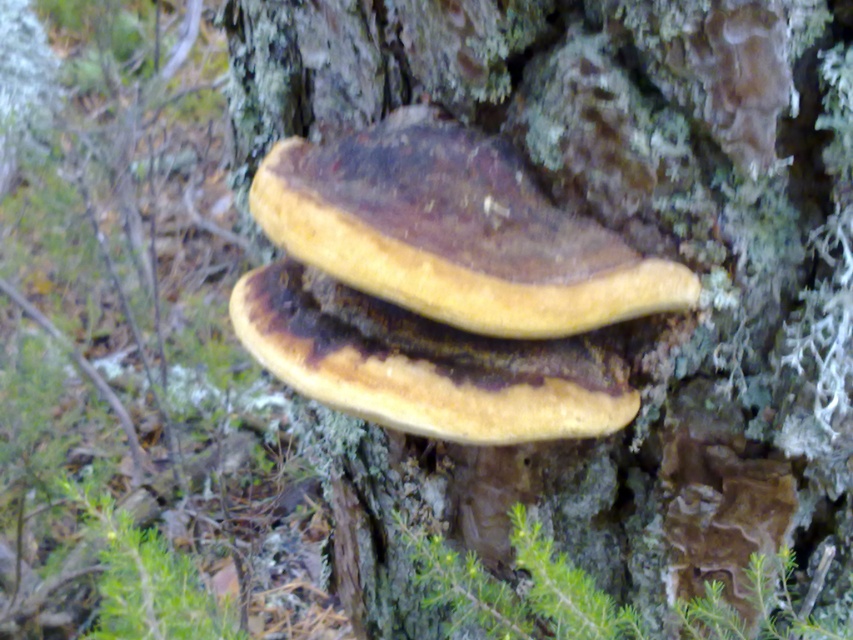
From the picture: Is brown leathery fungus at center positioned behind yellowish-brown wood at center?

No, it is not.

Does point (390, 125) come closer to viewer compared to point (331, 364)?

No, (390, 125) is further to viewer.

Where is `brown leathery fungus at center`? This screenshot has width=853, height=640. brown leathery fungus at center is located at coordinates (454, 230).

From the picture: Can you confirm if brown/corky mushroom at center is wider than yellowish-brown wood at center?

Indeed, brown/corky mushroom at center has a greater width compared to yellowish-brown wood at center.

Can you confirm if brown/corky mushroom at center is positioned to the left of yellowish-brown wood at center?

Incorrect, brown/corky mushroom at center is not on the left side of yellowish-brown wood at center.

Which is in front, point (656, 77) or point (543, 362)?

Positioned in front is point (656, 77).

Find the location of a particular element. The width and height of the screenshot is (853, 640). brown/corky mushroom at center is located at coordinates (633, 244).

Who is positioned more to the right, brown/corky mushroom at center or brown leathery fungus at center?

Positioned to the right is brown leathery fungus at center.

Which of these two, brown/corky mushroom at center or brown leathery fungus at center, stands shorter?

With less height is brown leathery fungus at center.

Which is in front, point (502, 568) or point (552, 296)?

Point (552, 296)

The height and width of the screenshot is (640, 853). In order to click on brown/corky mushroom at center in this screenshot , I will do `click(633, 244)`.